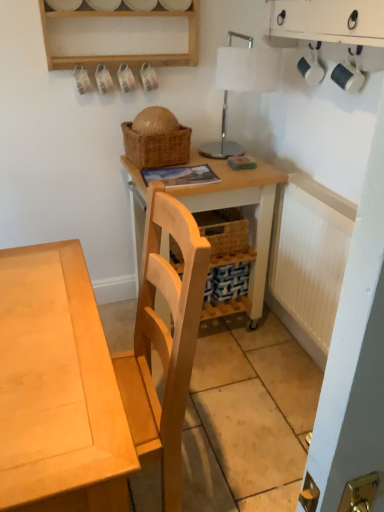
Question: Is white glossy table lamp at upper center facing away from woven brown picnic basket at upper center?

Choices:
 (A) no
 (B) yes

Answer: (A)

Question: Considering the relative sizes of white glossy table lamp at upper center and woven brown picnic basket at upper center in the image provided, is white glossy table lamp at upper center wider than woven brown picnic basket at upper center?

Choices:
 (A) no
 (B) yes

Answer: (B)

Question: From the image's perspective, does white glossy table lamp at upper center appear lower than woven brown picnic basket at upper center?

Choices:
 (A) no
 (B) yes

Answer: (A)

Question: Are white glossy table lamp at upper center and woven brown picnic basket at upper center making contact?

Choices:
 (A) yes
 (B) no

Answer: (B)

Question: Considering the relative sizes of white glossy table lamp at upper center and woven brown picnic basket at upper center in the image provided, is white glossy table lamp at upper center shorter than woven brown picnic basket at upper center?

Choices:
 (A) yes
 (B) no

Answer: (B)

Question: In terms of size, does woven brown picnic basket at upper center appear bigger or smaller than white ribbed radiator at right?

Choices:
 (A) small
 (B) big

Answer: (A)

Question: From a real-world perspective, is woven brown picnic basket at upper center physically located above or below white ribbed radiator at right?

Choices:
 (A) above
 (B) below

Answer: (A)

Question: Is woven brown picnic basket at upper center in front of or behind white ribbed radiator at right in the image?

Choices:
 (A) front
 (B) behind

Answer: (B)

Question: Is woven brown picnic basket at upper center wider or thinner than white ribbed radiator at right?

Choices:
 (A) thin
 (B) wide

Answer: (B)

Question: Considering the positions of point (130, 177) and point (1, 329), is point (130, 177) closer or farther from the camera than point (1, 329)?

Choices:
 (A) farther
 (B) closer

Answer: (A)

Question: Is wooden table at center in front of or behind light wood desk at center in the image?

Choices:
 (A) behind
 (B) front

Answer: (A)

Question: From a real-world perspective, is wooden table at center above or below light wood desk at center?

Choices:
 (A) below
 (B) above

Answer: (A)

Question: From their relative heights in the image, would you say wooden table at center is taller or shorter than light wood desk at center?

Choices:
 (A) short
 (B) tall

Answer: (A)

Question: Choose the correct answer: Is woven brown picnic basket at upper center inside wooden table at center or outside it?

Choices:
 (A) outside
 (B) inside

Answer: (A)

Question: From their relative heights in the image, would you say woven brown picnic basket at upper center is taller or shorter than wooden table at center?

Choices:
 (A) short
 (B) tall

Answer: (A)